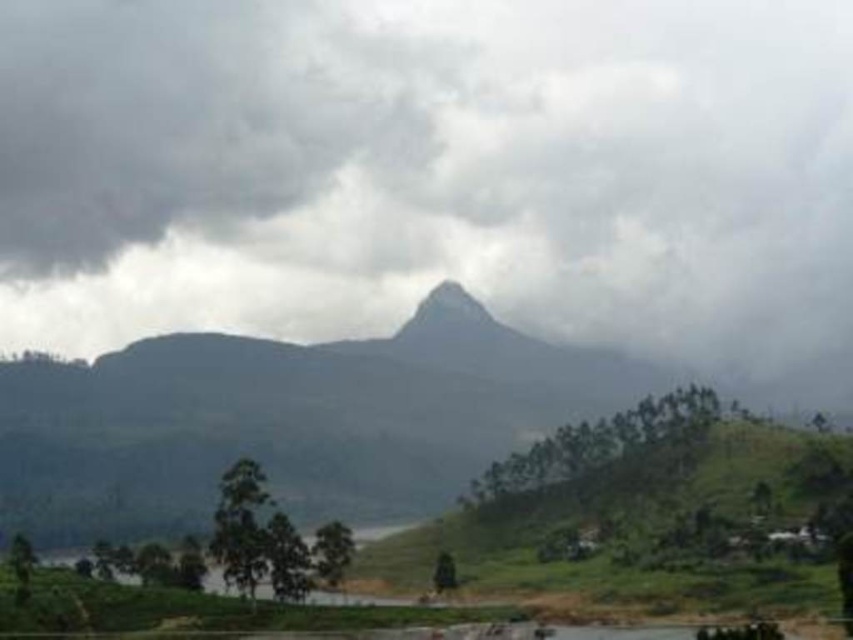
Question: Can you confirm if gray cloudy sky at center is thinner than dark gray rocky mountain at center?

Choices:
 (A) yes
 (B) no

Answer: (B)

Question: Which object appears closest to the camera in this image?

Choices:
 (A) gray cloudy sky at center
 (B) dark gray rocky mountain at center

Answer: (B)

Question: Is gray cloudy sky at center wider than dark gray rocky mountain at center?

Choices:
 (A) no
 (B) yes

Answer: (B)

Question: From the image, what is the correct spatial relationship of gray cloudy sky at center in relation to dark gray rocky mountain at center?

Choices:
 (A) above
 (B) below

Answer: (A)

Question: Which object appears closest to the camera in this image?

Choices:
 (A) dark gray rocky mountain at center
 (B) gray cloudy sky at center

Answer: (A)